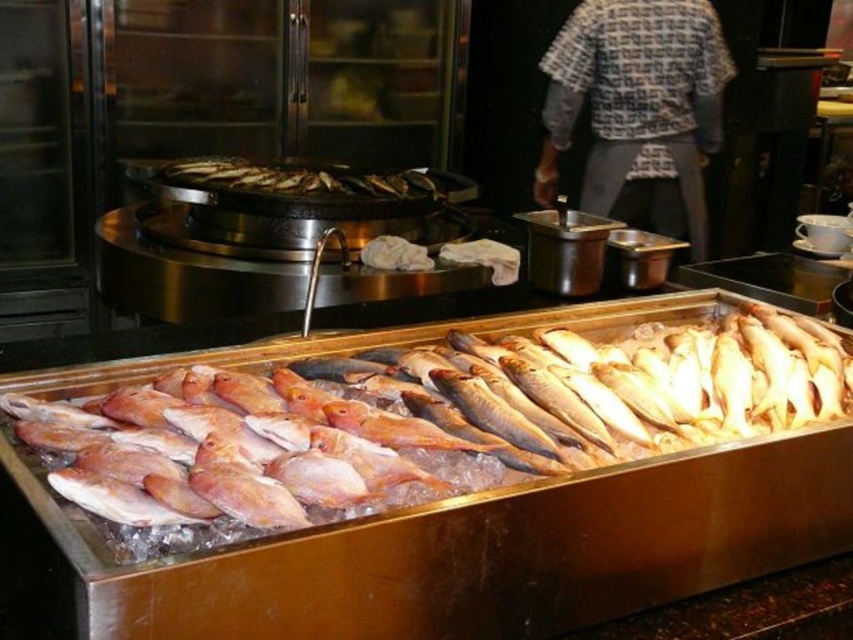
Question: Which point appears farthest from the camera in this image?

Choices:
 (A) (312, 173)
 (B) (641, 340)
 (C) (599, 22)

Answer: (C)

Question: Is pinkish-silver fish at center in front of brown matte fish at center?

Choices:
 (A) yes
 (B) no

Answer: (A)

Question: Can you confirm if pinkish-silver fish at center is smaller than brown matte fish at center?

Choices:
 (A) yes
 (B) no

Answer: (B)

Question: Estimate the real-world distances between objects in this image. Which object is farther from the brown matte fish at center?

Choices:
 (A) patterned fabric shirt at center
 (B) pinkish-silver fish at center

Answer: (B)

Question: Where is pinkish-silver fish at center located in relation to patterned fabric shirt at center in the image?

Choices:
 (A) left
 (B) right

Answer: (A)

Question: Which point is farther to the camera?

Choices:
 (A) pinkish-silver fish at center
 (B) brown matte fish at center

Answer: (B)